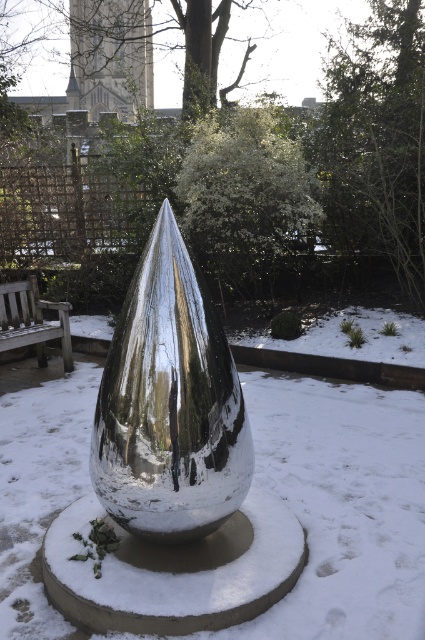
Can you confirm if green leafy tree at upper center is smaller than wooden park bench at left?

No.

Who is lower down, green leafy tree at upper center or wooden park bench at left?

wooden park bench at left is lower down.

Locate an element on the screen. The height and width of the screenshot is (640, 425). green leafy tree at upper center is located at coordinates (107, 54).

Does green leafy tree at upper right have a smaller size compared to green leafy tree at upper center?

No.

Who is positioned more to the left, green leafy tree at upper right or green leafy tree at upper center?

From the viewer's perspective, green leafy tree at upper center appears more on the left side.

Who is more distant from viewer, (422, 180) or (241, 54)?

The point (241, 54) is behind.

The height and width of the screenshot is (640, 425). Find the location of `green leafy tree at upper right`. green leafy tree at upper right is located at coordinates (376, 140).

Can you confirm if green leafy tree at upper right is taller than white textured bush at center?

Indeed, green leafy tree at upper right has a greater height compared to white textured bush at center.

Measure the distance from green leafy tree at upper right to white textured bush at center.

green leafy tree at upper right and white textured bush at center are 37.61 inches apart.

Which is in front, point (411, 76) or point (257, 282)?

Point (411, 76) is in front.

What are the coordinates of `green leafy tree at upper right` in the screenshot? It's located at (376, 140).